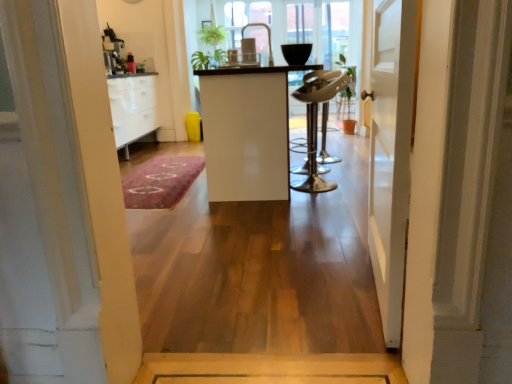
Question: Should I look upward or downward to see white wooden door at center?

Choices:
 (A) down
 (B) up

Answer: (B)

Question: Can we say white wooden door at center lies outside pink carpet at center?

Choices:
 (A) yes
 (B) no

Answer: (A)

Question: Does white wooden door at center have a greater width compared to pink carpet at center?

Choices:
 (A) no
 (B) yes

Answer: (A)

Question: Does white wooden door at center have a lesser height compared to pink carpet at center?

Choices:
 (A) no
 (B) yes

Answer: (A)

Question: From a real-world perspective, is white wooden door at center under pink carpet at center?

Choices:
 (A) no
 (B) yes

Answer: (A)

Question: Is white wooden door at center in contact with pink carpet at center?

Choices:
 (A) yes
 (B) no

Answer: (B)

Question: Is white wooden door at center positioned in front of pink carpet at center?

Choices:
 (A) yes
 (B) no

Answer: (A)

Question: Is pink carpet at center oriented away from white wooden door at center?

Choices:
 (A) no
 (B) yes

Answer: (A)

Question: Does pink carpet at center appear on the left side of white wooden door at center?

Choices:
 (A) no
 (B) yes

Answer: (B)

Question: Does pink carpet at center lie in front of white wooden door at center?

Choices:
 (A) yes
 (B) no

Answer: (B)

Question: From the image's perspective, is pink carpet at center above white wooden door at center?

Choices:
 (A) yes
 (B) no

Answer: (B)

Question: Considering the relative sizes of pink carpet at center and white wooden door at center in the image provided, is pink carpet at center wider than white wooden door at center?

Choices:
 (A) no
 (B) yes

Answer: (B)

Question: From a real-world perspective, is pink carpet at center positioned under white wooden door at center based on gravity?

Choices:
 (A) no
 (B) yes

Answer: (B)

Question: Does white glossy cabinet at center have a lesser width compared to white wooden door at center?

Choices:
 (A) no
 (B) yes

Answer: (A)